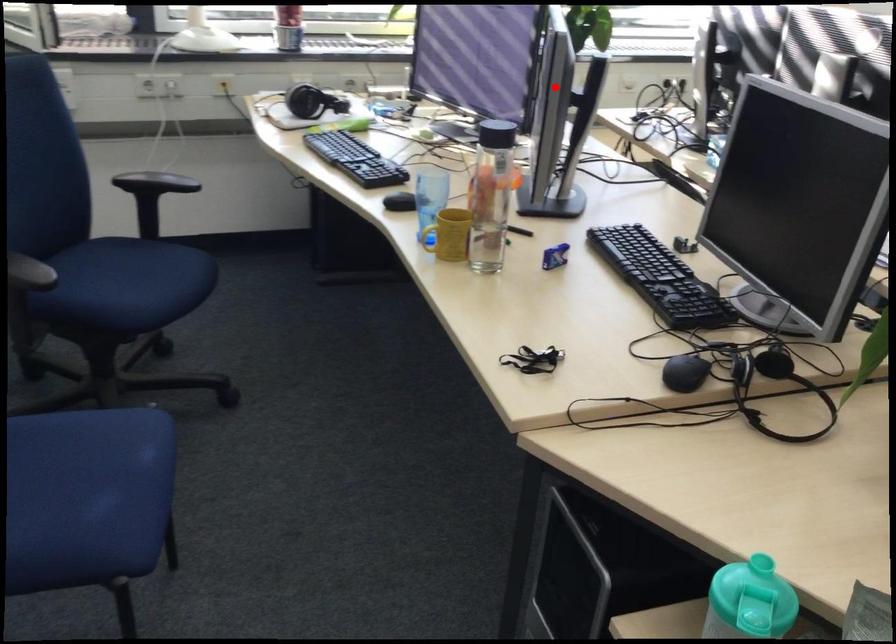
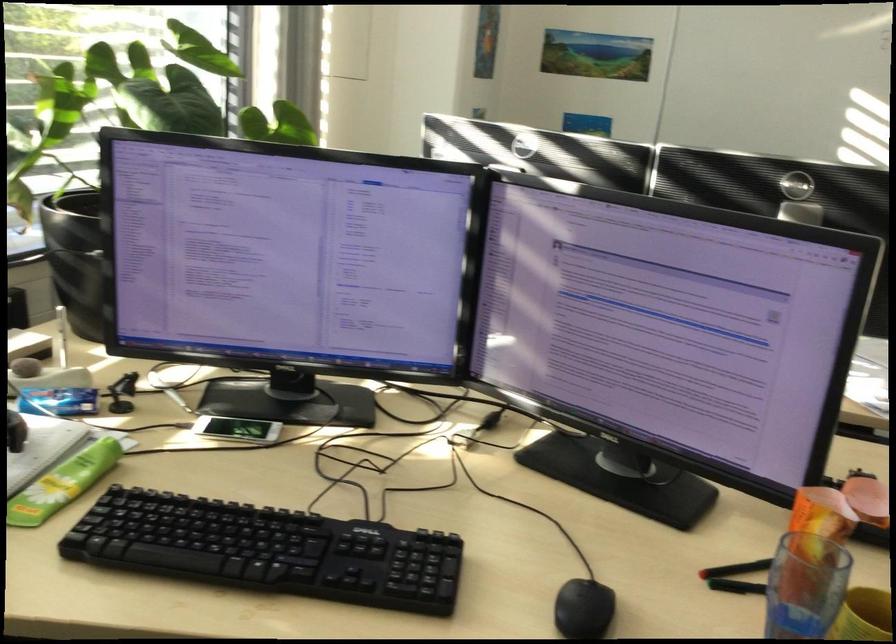
In the second image, find the point that corresponds to the highlighted location in the first image.

(826, 328)